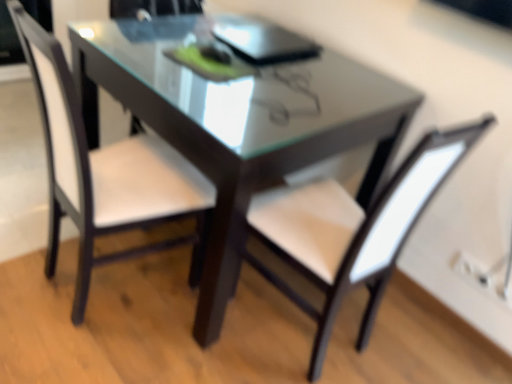
Question: From a real-world perspective, is white leather chair at center, marked as the first chair in a right-to-left arrangement, located higher than white leather chair at center, the second chair from the right?

Choices:
 (A) no
 (B) yes

Answer: (A)

Question: Is white leather chair at center, marked as the 2th chair in a left-to-right arrangement, oriented away from white leather chair at center, marked as the 1th chair in a left-to-right arrangement?

Choices:
 (A) no
 (B) yes

Answer: (A)

Question: Is white leather chair at center, marked as the first chair in a right-to-left arrangement, thinner than white leather chair at center, marked as the 1th chair in a left-to-right arrangement?

Choices:
 (A) no
 (B) yes

Answer: (A)

Question: Would you say white leather chair at center, marked as the 2th chair in a left-to-right arrangement, is a long distance from white leather chair at center, marked as the 1th chair in a left-to-right arrangement?

Choices:
 (A) no
 (B) yes

Answer: (A)

Question: Is white leather chair at center, marked as the first chair in a right-to-left arrangement, taller than white leather chair at center, marked as the 1th chair in a left-to-right arrangement?

Choices:
 (A) yes
 (B) no

Answer: (A)

Question: Would you say white leather chair at center, marked as the 1th chair in a left-to-right arrangement, is inside or outside white leather chair at center, marked as the 2th chair in a left-to-right arrangement?

Choices:
 (A) outside
 (B) inside

Answer: (A)

Question: From a real-world perspective, relative to white leather chair at center, marked as the first chair in a right-to-left arrangement, is white leather chair at center, marked as the 1th chair in a left-to-right arrangement, vertically above or below?

Choices:
 (A) above
 (B) below

Answer: (A)

Question: In the image, is white leather chair at center, the second chair from the right, positioned in front of or behind white leather chair at center, marked as the first chair in a right-to-left arrangement?

Choices:
 (A) behind
 (B) front

Answer: (A)

Question: Is white leather chair at center, the second chair from the right, wider or thinner than white leather chair at center, marked as the first chair in a right-to-left arrangement?

Choices:
 (A) wide
 (B) thin

Answer: (B)

Question: Do you think white leather chair at center, marked as the first chair in a right-to-left arrangement, is within white leather chair at center, the second chair from the right, or outside of it?

Choices:
 (A) outside
 (B) inside

Answer: (A)

Question: Is point (339, 253) positioned closer to the camera than point (38, 84)?

Choices:
 (A) closer
 (B) farther

Answer: (A)

Question: From a real-world perspective, is white leather chair at center, marked as the 2th chair in a left-to-right arrangement, physically located above or below white leather chair at center, the second chair from the right?

Choices:
 (A) below
 (B) above

Answer: (A)

Question: Is white leather chair at center, marked as the 2th chair in a left-to-right arrangement, in front of or behind white leather chair at center, the second chair from the right, in the image?

Choices:
 (A) behind
 (B) front

Answer: (B)

Question: Based on their positions, is transparent glass table at center located to the left or right of white leather chair at center, the second chair from the right?

Choices:
 (A) left
 (B) right

Answer: (B)

Question: Considering the positions of point (93, 34) and point (197, 268), is point (93, 34) closer or farther from the camera than point (197, 268)?

Choices:
 (A) closer
 (B) farther

Answer: (A)